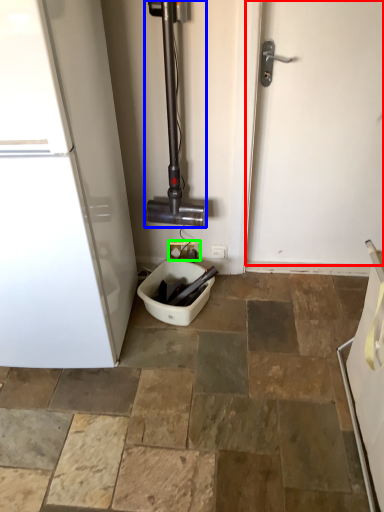
Question: Considering the real-world distances, which object is closest to door (highlighted by a red box)? pipe (highlighted by a blue box) or electric outlet (highlighted by a green box).

Choices:
 (A) pipe
 (B) electric outlet

Answer: (A)